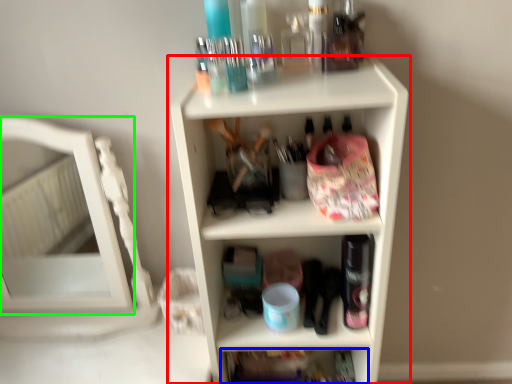
Question: Which object is positioned farthest from shelf (highlighted by a red box)? Select from shelf (highlighted by a blue box) and mirror (highlighted by a green box).

Choices:
 (A) shelf
 (B) mirror

Answer: (B)